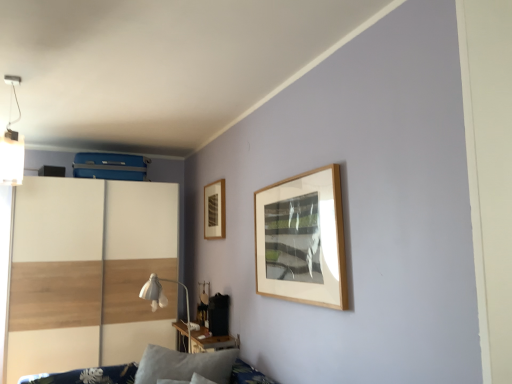
At what (x,y) coordinates should I click in order to perform the action: click on blank space situated above white matte light fixture at upper left (from a real-world perspective). Please return your answer as a coordinate pair (x, y). This screenshot has width=512, height=384. Looking at the image, I should click on (14, 79).